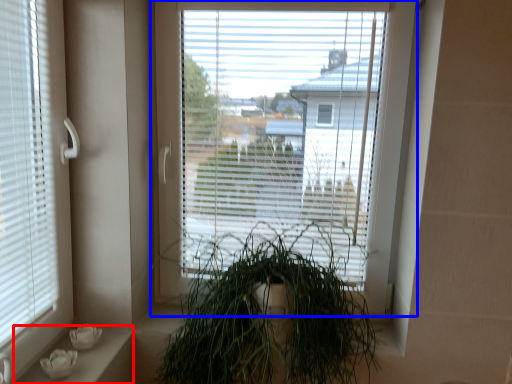
Question: Among these objects, which one is nearest to the camera, window sill (highlighted by a red box) or window (highlighted by a blue box)?

Choices:
 (A) window sill
 (B) window

Answer: (A)